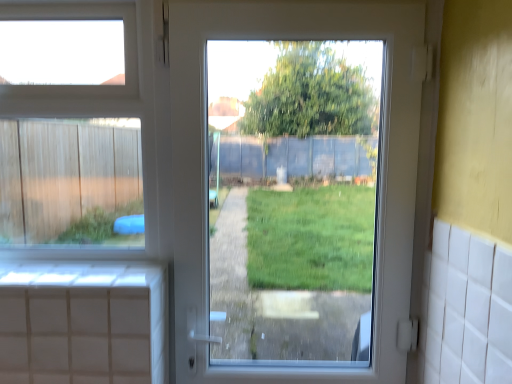
The width and height of the screenshot is (512, 384). What do you see at coordinates (112, 110) in the screenshot?
I see `transparent glass window at upper left` at bounding box center [112, 110].

Find the location of `transparent glass window at upper left`. transparent glass window at upper left is located at coordinates (112, 110).

Locate an element on the screen. The height and width of the screenshot is (384, 512). white glossy door at center is located at coordinates (381, 169).

The image size is (512, 384). What do you see at coordinates (381, 169) in the screenshot?
I see `white glossy door at center` at bounding box center [381, 169].

Image resolution: width=512 pixels, height=384 pixels. Find the location of `transparent glass window at upper left`. transparent glass window at upper left is located at coordinates (112, 110).

Which object is positioned more to the left, white glossy door at center or transparent glass window at upper left?

transparent glass window at upper left is more to the left.

Is white glossy door at center positioned in front of transparent glass window at upper left?

Yes, white glossy door at center is in front of transparent glass window at upper left.

Between point (246, 7) and point (130, 47), which one is positioned behind?

The point (130, 47) is farther.

From the image's perspective, is white glossy door at center above transparent glass window at upper left?

No, from the image's perspective, white glossy door at center is not on top of transparent glass window at upper left.

From a real-world perspective, which is physically below, white glossy door at center or transparent glass window at upper left?

white glossy door at center, from a real-world perspective.

Considering the sizes of objects white glossy door at center and transparent glass window at upper left in the image provided, who is wider, white glossy door at center or transparent glass window at upper left?

white glossy door at center is wider.

Which of these two, white glossy door at center or transparent glass window at upper left, stands taller?

With more height is white glossy door at center.

Considering the relative sizes of white glossy door at center and transparent glass window at upper left in the image provided, is white glossy door at center smaller than transparent glass window at upper left?

No.

Could transparent glass window at upper left be considered to be inside white glossy door at center?

Actually, transparent glass window at upper left is outside white glossy door at center.

Is white glossy door at center not close to transparent glass window at upper left?

white glossy door at center is near transparent glass window at upper left, not far away.

Could you tell me if white glossy door at center is turned towards transparent glass window at upper left?

No, white glossy door at center is not aimed at transparent glass window at upper left.

How many degrees apart are the facing directions of white glossy door at center and transparent glass window at upper left?

The angle between the facing direction of white glossy door at center and the facing direction of transparent glass window at upper left is 0.106 degrees.

The width and height of the screenshot is (512, 384). Find the location of `door below the transparent glass window at upper left (from the image's perspective)`. door below the transparent glass window at upper left (from the image's perspective) is located at coordinates (381, 169).

Considering the positions of objects transparent glass window at upper left and white glossy door at center in the image provided, who is more to the left, transparent glass window at upper left or white glossy door at center?

From the viewer's perspective, transparent glass window at upper left appears more on the left side.

Is transparent glass window at upper left in front of or behind white glossy door at center in the image?

transparent glass window at upper left is behind white glossy door at center.

Considering the points (21, 7) and (397, 213), which point is in front, point (21, 7) or point (397, 213)?

The point (397, 213) is closer to the camera.

From the image's perspective, which is below, transparent glass window at upper left or white glossy door at center?

white glossy door at center, from the image's perspective.

From a real-world perspective, is transparent glass window at upper left on top of white glossy door at center?

Yes, from a real-world perspective, transparent glass window at upper left is on top of white glossy door at center.

Can you confirm if transparent glass window at upper left is thinner than white glossy door at center?

Yes.

Who is taller, transparent glass window at upper left or white glossy door at center?

white glossy door at center.

Is transparent glass window at upper left smaller than white glossy door at center?

Yes.

Is transparent glass window at upper left positioned beyond the bounds of white glossy door at center?

Indeed, transparent glass window at upper left is completely outside white glossy door at center.

Is transparent glass window at upper left far from white glossy door at center?

No, transparent glass window at upper left is in close proximity to white glossy door at center.

Is transparent glass window at upper left positioned with its back to white glossy door at center?

No, transparent glass window at upper left is not facing the opposite direction of white glossy door at center.

How distant is transparent glass window at upper left from white glossy door at center?

They are 11.14 inches apart.

At what (x,y) coordinates should I click in order to perform the action: click on window lying above the white glossy door at center (from the image's perspective). Please return your answer as a coordinate pair (x, y). Looking at the image, I should click on (112, 110).

Image resolution: width=512 pixels, height=384 pixels. Find the location of `door located in front of the transparent glass window at upper left`. door located in front of the transparent glass window at upper left is located at coordinates (381, 169).

I want to click on window that appears on the left of white glossy door at center, so click(x=112, y=110).